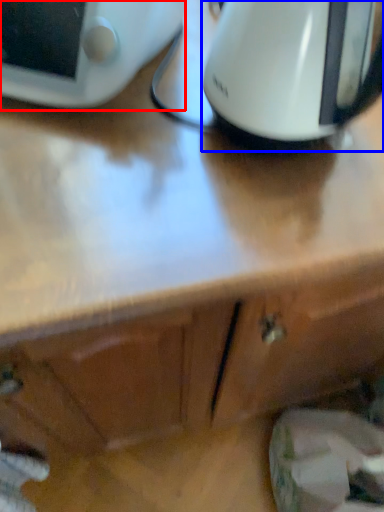
Question: Which of the following is the closest to the observer, home appliance (highlighted by a red box) or kitchen appliance (highlighted by a blue box)?

Choices:
 (A) home appliance
 (B) kitchen appliance

Answer: (B)